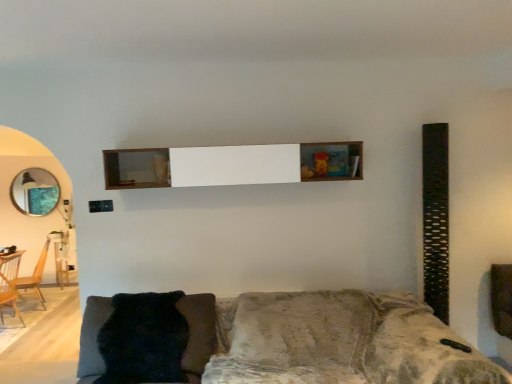
Locate an element on the screen. The width and height of the screenshot is (512, 384). wooden armchair at left, the first armchair when ordered from front to back is located at coordinates (9, 283).

What is the approximate width of wooden armchair at left, the first armchair when ordered from front to back?

wooden armchair at left, the first armchair when ordered from front to back, is 22.87 inches in width.

The width and height of the screenshot is (512, 384). What do you see at coordinates (144, 339) in the screenshot? I see `fuzzy black pillow at lower left` at bounding box center [144, 339].

The width and height of the screenshot is (512, 384). In order to click on wooden shelf at center in this screenshot , I will do `click(232, 165)`.

How much space does wooden armchair at left, marked as the 1th armchair in a back-to-front arrangement, occupy horizontally?

wooden armchair at left, marked as the 1th armchair in a back-to-front arrangement, is 22.20 inches in width.

What are the coordinates of `matte glass mirror at left` in the screenshot? It's located at (35, 192).

Where is `shelf that appears on the right of wooden armchair at left, which is counted as the 2th armchair, starting from the back`? The image size is (512, 384). shelf that appears on the right of wooden armchair at left, which is counted as the 2th armchair, starting from the back is located at coordinates (232, 165).

Visually, is wooden armchair at left, the first armchair when ordered from front to back, positioned to the left or to the right of wooden shelf at center?

Clearly, wooden armchair at left, the first armchair when ordered from front to back, is on the left of wooden shelf at center in the image.

Based on the photo, considering the relative sizes of wooden armchair at left, which is counted as the 2th armchair, starting from the back, and wooden shelf at center in the image provided, is wooden armchair at left, which is counted as the 2th armchair, starting from the back, smaller than wooden shelf at center?

Actually, wooden armchair at left, which is counted as the 2th armchair, starting from the back, might be larger than wooden shelf at center.

From a real-world perspective, is wooden armchair at left, which is counted as the 2th armchair, starting from the back, located higher than wooden shelf at center?

No, from a real-world perspective, wooden armchair at left, which is counted as the 2th armchair, starting from the back, is not on top of wooden shelf at center.

Could you tell me if wooden shelf at center is turned towards fuzzy black pillow at lower left?

No, wooden shelf at center is not oriented towards fuzzy black pillow at lower left.

Choose the correct answer: Is wooden shelf at center inside fuzzy black pillow at lower left or outside it?

wooden shelf at center is spatially situated outside fuzzy black pillow at lower left.

From a real-world perspective, which object rests below the other?

fuzzy black pillow at lower left, from a real-world perspective.

Which of these two, wooden shelf at center or matte glass mirror at left, is smaller?

matte glass mirror at left.

Does wooden shelf at center have a greater width compared to matte glass mirror at left?

Indeed, wooden shelf at center has a greater width compared to matte glass mirror at left.

From the image's perspective, which is below, wooden shelf at center or matte glass mirror at left?

matte glass mirror at left.

From a real-world perspective, which is physically below, wooden shelf at center or matte glass mirror at left?

In real-world perspective, matte glass mirror at left is lower.

The height and width of the screenshot is (384, 512). I want to click on the 1st armchair below the velvet-like gray couch at lower center (from the image's perspective), so click(x=36, y=275).

Can you tell me how much velvet-like gray couch at lower center and wooden armchair at left, which ranks as the second armchair in front-to-back order, differ in facing direction?

The angle between the facing direction of velvet-like gray couch at lower center and the facing direction of wooden armchair at left, which ranks as the second armchair in front-to-back order, is 64.4 degrees.

Is velvet-like gray couch at lower center oriented away from wooden armchair at left, which ranks as the second armchair in front-to-back order?

No, velvet-like gray couch at lower center is not facing the opposite direction of wooden armchair at left, which ranks as the second armchair in front-to-back order.

In terms of height, does velvet-like gray couch at lower center look taller or shorter compared to wooden armchair at left, which ranks as the second armchair in front-to-back order?

velvet-like gray couch at lower center is shorter than wooden armchair at left, which ranks as the second armchair in front-to-back order.

Considering the sizes of objects wooden shelf at center and velvet-like gray couch at lower center in the image provided, who is bigger, wooden shelf at center or velvet-like gray couch at lower center?

With larger size is velvet-like gray couch at lower center.

Which is in front, wooden shelf at center or velvet-like gray couch at lower center?

velvet-like gray couch at lower center is more forward.

Looking at this image, what's the angular difference between wooden shelf at center and velvet-like gray couch at lower center's facing directions?

They differ by 0.504 degrees in their facing directions.

Is the surface of wooden shelf at center in direct contact with velvet-like gray couch at lower center?

There is a gap between wooden shelf at center and velvet-like gray couch at lower center.

Considering the relative sizes of fuzzy black pillow at lower left and matte glass mirror at left in the image provided, is fuzzy black pillow at lower left thinner than matte glass mirror at left?

No.

Considering the relative positions of fuzzy black pillow at lower left and matte glass mirror at left in the image provided, is fuzzy black pillow at lower left to the left of matte glass mirror at left from the viewer's perspective?

Incorrect, fuzzy black pillow at lower left is not on the left side of matte glass mirror at left.

From the picture: In terms of height, does fuzzy black pillow at lower left look taller or shorter compared to matte glass mirror at left?

Answer: In the image, fuzzy black pillow at lower left appears to be shorter than matte glass mirror at left.

From a real-world perspective, which object rests below the other?

In real-world perspective, fuzzy black pillow at lower left is lower.

Does point (31, 186) appear closer or farther from the camera than point (15, 275)?

Point (31, 186) is farther from the camera than point (15, 275).

From the picture: Are matte glass mirror at left and wooden armchair at left, the first armchair when ordered from front to back, located far from each other?

No, matte glass mirror at left is not far away from wooden armchair at left, the first armchair when ordered from front to back.

How many degrees apart are the facing directions of matte glass mirror at left and wooden armchair at left, the first armchair when ordered from front to back?

106 degrees separate the facing orientations of matte glass mirror at left and wooden armchair at left, the first armchair when ordered from front to back.

From the image's perspective, which is above, matte glass mirror at left or wooden armchair at left, the first armchair when ordered from front to back?

From the image's view, matte glass mirror at left is above.

From the image's perspective, which armchair is the 2nd one below the wooden shelf at center? Please provide its 2D coordinates.

[(9, 283)]

This screenshot has height=384, width=512. I want to click on pillow that is under the wooden shelf at center (from a real-world perspective), so click(144, 339).

Looking at the image, which one is located further to velvet-like gray couch at lower center, wooden shelf at center or wooden armchair at left, marked as the 1th armchair in a back-to-front arrangement?

wooden armchair at left, marked as the 1th armchair in a back-to-front arrangement, is positioned further to the anchor velvet-like gray couch at lower center.

Looking at the image, which one is located further to wooden shelf at center, fuzzy black pillow at lower left or matte glass mirror at left?

matte glass mirror at left is positioned further to the anchor wooden shelf at center.

When comparing their distances from wooden armchair at left, which ranks as the second armchair in front-to-back order, does wooden shelf at center or fuzzy black pillow at lower left seem further?

wooden shelf at center lies further to wooden armchair at left, which ranks as the second armchair in front-to-back order, than the other object.

From the image, which object appears to be farther from velvet-like gray couch at lower center, matte glass mirror at left or wooden armchair at left, which ranks as the second armchair in front-to-back order?

wooden armchair at left, which ranks as the second armchair in front-to-back order, is positioned further to the anchor velvet-like gray couch at lower center.

Based on the photo, considering their positions, is wooden shelf at center positioned further to fuzzy black pillow at lower left than wooden armchair at left, the first armchair when ordered from front to back?

wooden armchair at left, the first armchair when ordered from front to back, is positioned further to the anchor fuzzy black pillow at lower left.

Which object lies nearer to the anchor point matte glass mirror at left, wooden armchair at left, which is counted as the 2th armchair, starting from the back, or velvet-like gray couch at lower center?

wooden armchair at left, which is counted as the 2th armchair, starting from the back, is positioned closer to the anchor matte glass mirror at left.

From the image, which object appears to be nearer to fuzzy black pillow at lower left, wooden armchair at left, marked as the 1th armchair in a back-to-front arrangement, or velvet-like gray couch at lower center?

velvet-like gray couch at lower center is positioned closer to the anchor fuzzy black pillow at lower left.

From the image, which object appears to be nearer to wooden armchair at left, which is counted as the 2th armchair, starting from the back, fuzzy black pillow at lower left or wooden armchair at left, marked as the 1th armchair in a back-to-front arrangement?

wooden armchair at left, marked as the 1th armchair in a back-to-front arrangement, is closer to wooden armchair at left, which is counted as the 2th armchair, starting from the back.

At what (x,y) coordinates should I click in order to perform the action: click on armchair between fuzzy black pillow at lower left and wooden armchair at left, which ranks as the second armchair in front-to-back order, in the front-back direction. Please return your answer as a coordinate pair (x, y). This screenshot has width=512, height=384. Looking at the image, I should click on (9, 283).

Find the location of a particular element. This screenshot has width=512, height=384. armchair between wooden armchair at left, which is counted as the 2th armchair, starting from the back, and matte glass mirror at left from front to back is located at coordinates coord(36,275).

Where is `armchair situated between wooden armchair at left, which ranks as the second armchair in front-to-back order, and wooden shelf at center from left to right`? This screenshot has width=512, height=384. armchair situated between wooden armchair at left, which ranks as the second armchair in front-to-back order, and wooden shelf at center from left to right is located at coordinates (9, 283).

The width and height of the screenshot is (512, 384). I want to click on pillow located between velvet-like gray couch at lower center and matte glass mirror at left in the depth direction, so click(144, 339).